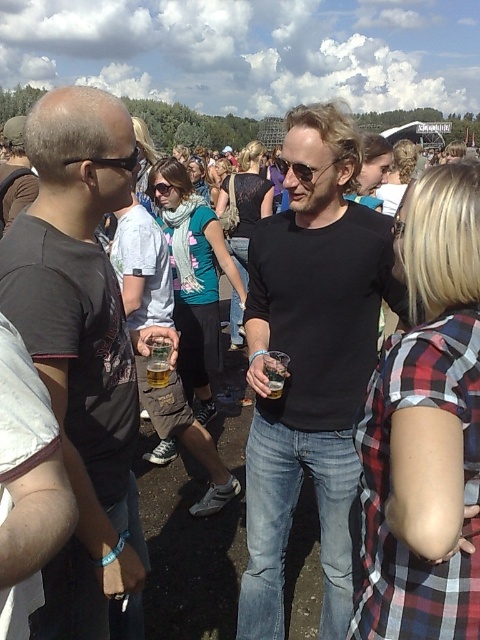
You are a photographer at the festival trying to capture a closeup of both the translucent glass beer at center and the translucent plastic cup at center. Can you fit both items in your camera frame if your focus area is 0.4 inches wide?

The distance between the translucent glass beer at center and the translucent plastic cup at center is 0.44 inches. Since your focus area is 0.4 inches wide, which is narrower than the space between them, you cannot fit both items in your camera frame.

You are standing at the center of the scene and want to move towards the two points marked in the image. Which point, point (156, 342) or point (153, 381), will you reach first?

Point (156, 342) is closer to the viewer than point (153, 381), so you will reach point (156, 342) first.